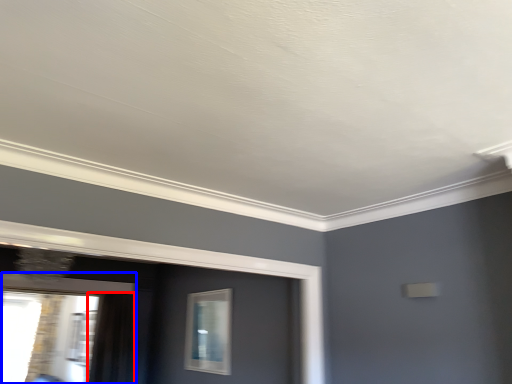
Question: Which of the following is the closest to the observer, curtain (highlighted by a red box) or window (highlighted by a blue box)?

Choices:
 (A) curtain
 (B) window

Answer: (B)